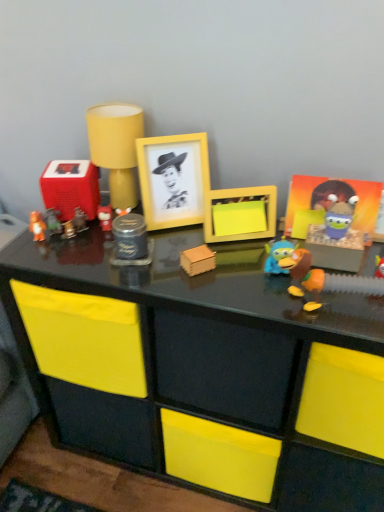
The width and height of the screenshot is (384, 512). Find the location of `free spot to the left of blue rubber duck at center, marked as the second toy in a right-to-left arrangement`. free spot to the left of blue rubber duck at center, marked as the second toy in a right-to-left arrangement is located at coordinates (220, 283).